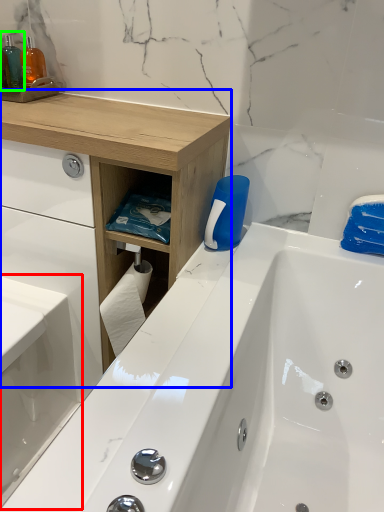
Question: Based on their relative distances, which object is nearer to sink (highlighted by a red box)? Choose from counter (highlighted by a blue box) and toiletry (highlighted by a green box).

Choices:
 (A) counter
 (B) toiletry

Answer: (A)